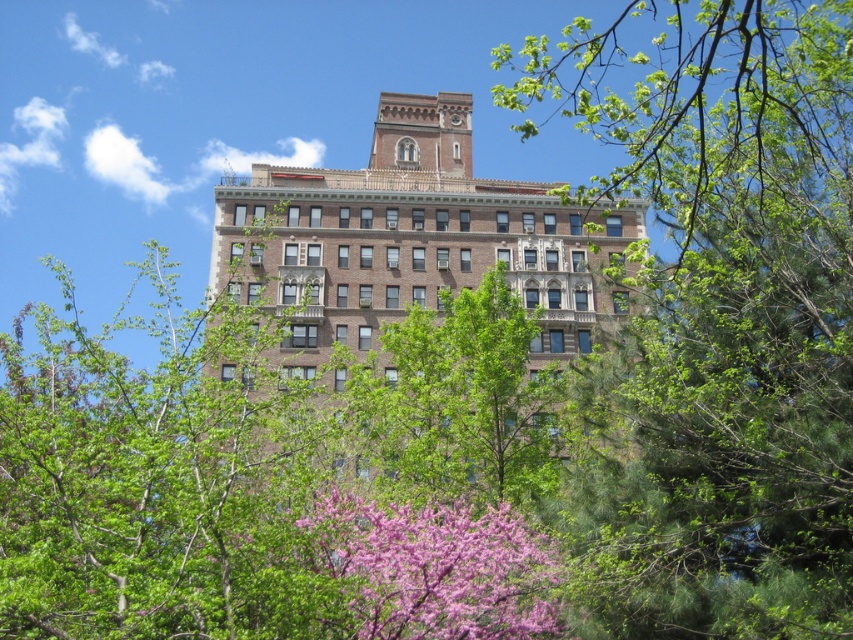
Is green leafy tree at upper center below brown brick building at center?

No.

Who is higher up, green leafy tree at upper center or brown brick building at center?

green leafy tree at upper center is higher up.

Locate an element on the screen. This screenshot has height=640, width=853. green leafy tree at upper center is located at coordinates (718, 321).

You are a GUI agent. You are given a task and a screenshot of the screen. Output one action in this format:
    pyautogui.click(x=<x>, y=<y>)
    Task: Click on the green leafy tree at upper center
    
    Given the screenshot: What is the action you would take?
    pyautogui.click(x=718, y=321)